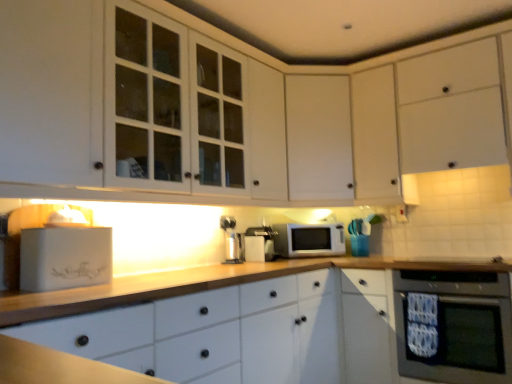
Question: Is black glass oven at lower right next to white matte microwave at center and touching it?

Choices:
 (A) yes
 (B) no

Answer: (B)

Question: Is black glass oven at lower right taller than white matte microwave at center?

Choices:
 (A) yes
 (B) no

Answer: (A)

Question: From the image's perspective, is black glass oven at lower right located beneath white matte microwave at center?

Choices:
 (A) yes
 (B) no

Answer: (A)

Question: From a real-world perspective, is black glass oven at lower right positioned over white matte microwave at center based on gravity?

Choices:
 (A) no
 (B) yes

Answer: (A)

Question: Is black glass oven at lower right at the right side of white matte microwave at center?

Choices:
 (A) yes
 (B) no

Answer: (A)

Question: Do you think satin silver coffee machine at center, arranged as the 2th coffee machine when viewed from the right, is within satin silver coffee machine at center, the first coffee machine when ordered from right to left, or outside of it?

Choices:
 (A) inside
 (B) outside

Answer: (B)

Question: From a real-world perspective, is satin silver coffee machine at center, arranged as the 2th coffee machine when viewed from the right, physically located above or below satin silver coffee machine at center, the first coffee machine when ordered from right to left?

Choices:
 (A) below
 (B) above

Answer: (A)

Question: Looking at their shapes, would you say satin silver coffee machine at center, arranged as the 2th coffee machine when viewed from the right, is wider or thinner than satin silver coffee machine at center, which is the second coffee machine in left-to-right order?

Choices:
 (A) wide
 (B) thin

Answer: (B)

Question: Considering the positions of point (233, 253) and point (271, 246), is point (233, 253) closer or farther from the camera than point (271, 246)?

Choices:
 (A) farther
 (B) closer

Answer: (B)

Question: Would you say white matte cabinet at center, which is counted as the third cabinetry, starting from the left, is to the left or to the right of white matte microwave at center in the picture?

Choices:
 (A) right
 (B) left

Answer: (A)

Question: In terms of width, does white matte cabinet at center, which is counted as the third cabinetry, starting from the left, look wider or thinner when compared to white matte microwave at center?

Choices:
 (A) wide
 (B) thin

Answer: (A)

Question: Is white matte cabinet at center, which is counted as the third cabinetry, starting from the left, in front of or behind white matte microwave at center in the image?

Choices:
 (A) front
 (B) behind

Answer: (A)

Question: Considering the positions of white matte cabinet at center, the 2th cabinetry from the right, and white matte microwave at center in the image, is white matte cabinet at center, the 2th cabinetry from the right, bigger or smaller than white matte microwave at center?

Choices:
 (A) big
 (B) small

Answer: (A)

Question: From the image's perspective, is black glass oven at lower right positioned above or below satin silver coffee machine at center, the first coffee machine when ordered from right to left?

Choices:
 (A) below
 (B) above

Answer: (A)

Question: Relative to satin silver coffee machine at center, the first coffee machine when ordered from right to left, is black glass oven at lower right in front or behind?

Choices:
 (A) front
 (B) behind

Answer: (A)